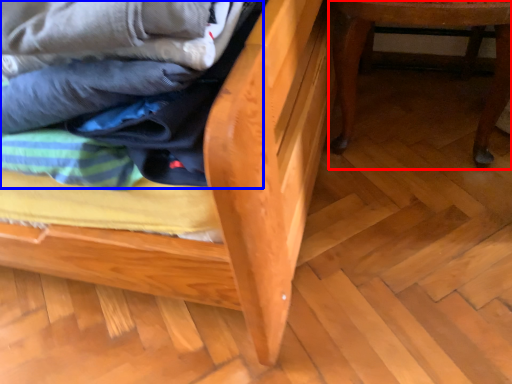
Question: Which object is closer to the camera taking this photo, furniture (highlighted by a red box) or laundry (highlighted by a blue box)?

Choices:
 (A) furniture
 (B) laundry

Answer: (B)